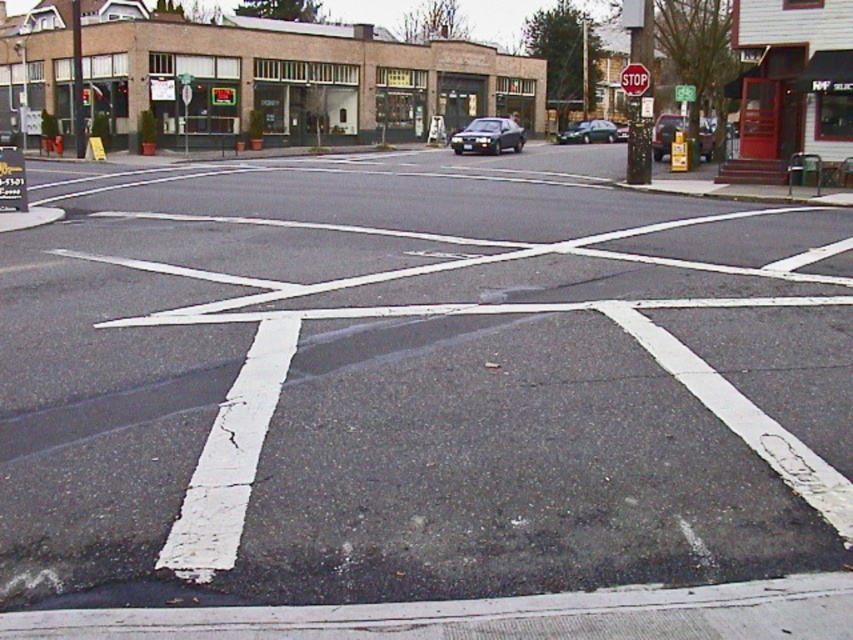
Looking at this image, is red metallic stop sign at upper center thinner than green plastic sign at upper center?

Incorrect, red metallic stop sign at upper center's width is not less than green plastic sign at upper center's.

Which is in front, point (641, 65) or point (691, 88)?

Point (641, 65)

This screenshot has width=853, height=640. Find the location of `red metallic stop sign at upper center`. red metallic stop sign at upper center is located at coordinates pos(634,80).

Can you confirm if metallic gray sedan at center is wider than metallic silver sedan at center?

No, metallic gray sedan at center is not wider than metallic silver sedan at center.

Does metallic gray sedan at center have a smaller size compared to metallic silver sedan at center?

Indeed, metallic gray sedan at center has a smaller size compared to metallic silver sedan at center.

Who is more distant from viewer, (518, 147) or (669, 138)?

The point (518, 147) is more distant.

Identify the location of metallic gray sedan at center. Image resolution: width=853 pixels, height=640 pixels. (488, 136).

Is black asphalt at center to the left of green glass traffic light at upper center from the viewer's perspective?

Incorrect, black asphalt at center is not on the left side of green glass traffic light at upper center.

Measure the distance between point (90, 538) and camera.

Point (90, 538) and camera are 4.31 meters apart from each other.

This screenshot has height=640, width=853. Identify the location of black asphalt at center. (416, 385).